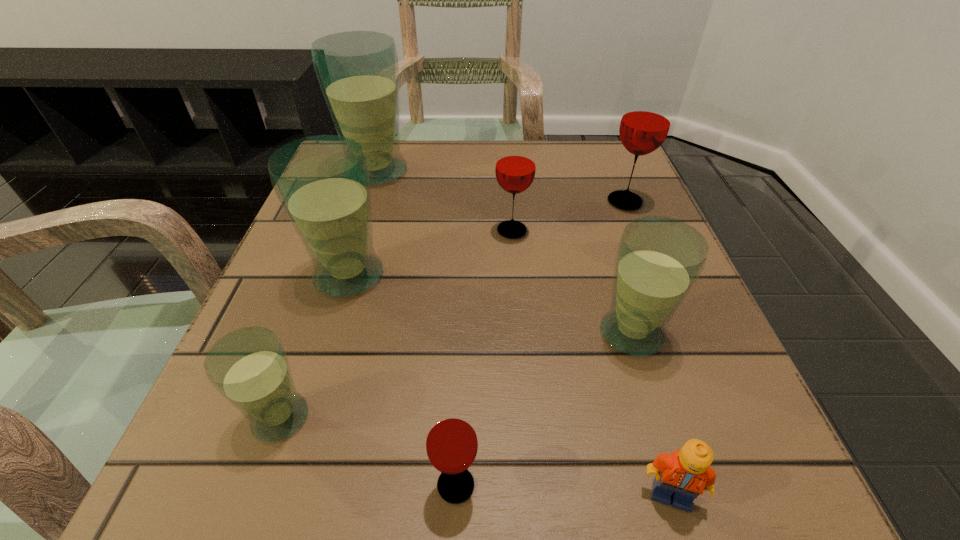
Locate an element on the screen. The height and width of the screenshot is (540, 960). empty space that is in between the farthest red glass and the third smallest blue glass is located at coordinates (487, 239).

This screenshot has width=960, height=540. Find the location of `unoccupied area between the fifth object from left to right and the nearest red glass`. unoccupied area between the fifth object from left to right and the nearest red glass is located at coordinates (484, 358).

This screenshot has height=540, width=960. I want to click on vacant area that lies between the third glass from right to left and the second nearest glass, so click(x=396, y=324).

You are a GUI agent. You are given a task and a screenshot of the screen. Output one action in this format:
    pyautogui.click(x=<x>, y=<y>)
    Task: Click on the vacant space in between the farthest blue glass and the second red glass from left to right
    
    Given the screenshot: What is the action you would take?
    pyautogui.click(x=444, y=201)

Point out which object is positioned as the sixth nearest to the third farthest blue glass. Please provide its 2D coordinates. Your answer should be formatted as a tuple, i.e. [(x, y)], where the tuple contains the x and y coordinates of a point satisfying the conditions above.

[(249, 367)]

The width and height of the screenshot is (960, 540). In order to click on the closest object to the biggest blue glass in this screenshot , I will do `click(322, 182)`.

In order to click on glass that stands as the closest to the nearest blue glass in this screenshot , I will do `click(322, 182)`.

Where is `glass that can be found as the closest to the fourth object from left to right`? This screenshot has width=960, height=540. glass that can be found as the closest to the fourth object from left to right is located at coordinates tap(249, 367).

You are a GUI agent. You are given a task and a screenshot of the screen. Output one action in this format:
    pyautogui.click(x=<x>, y=<y>)
    Task: Click on the blue glass object that ranks as the second closest to the third smallest blue glass
    The height and width of the screenshot is (540, 960).
    Given the screenshot: What is the action you would take?
    pyautogui.click(x=358, y=72)

Where is `blue glass identified as the closest to the rightmost blue glass`? blue glass identified as the closest to the rightmost blue glass is located at coordinates (322, 182).